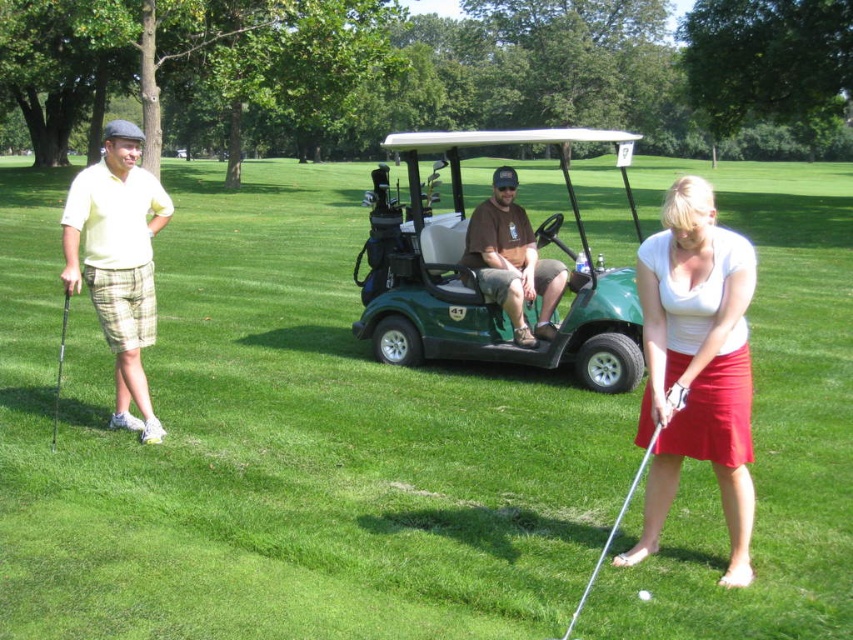
Question: Can you confirm if white matte skirt at lower right is positioned above brown cotton shirt at center?

Choices:
 (A) no
 (B) yes

Answer: (A)

Question: Observing the image, what is the correct spatial positioning of white matte skirt at lower right in reference to white matte golf ball at center?

Choices:
 (A) left
 (B) right

Answer: (B)

Question: Is green matte golf cart at center positioned at the back of light yellow cotton polo shirt at left?

Choices:
 (A) no
 (B) yes

Answer: (B)

Question: Which point is farther to the camera?

Choices:
 (A) (109, 177)
 (B) (611, 531)

Answer: (A)

Question: Which point appears farthest from the camera in this image?

Choices:
 (A) (614, 362)
 (B) (648, 452)
 (C) (51, 444)

Answer: (A)

Question: Which of these objects is positioned farthest from the brown cotton shirt at center?

Choices:
 (A) light yellow cotton polo shirt at left
 (B) green matte golf cart at center
 (C) metallic silver golf club at left
 (D) metallic silver golf club at lower right

Answer: (B)